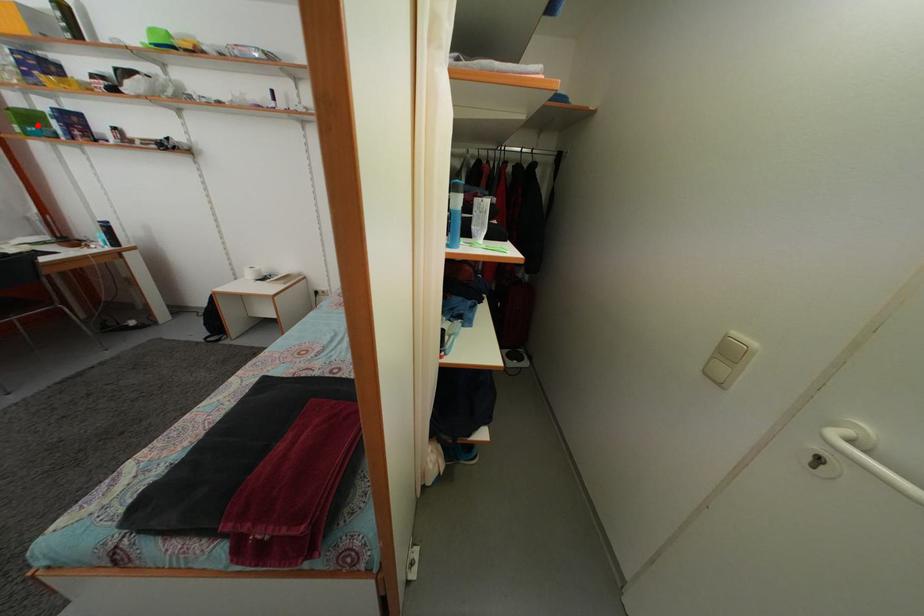
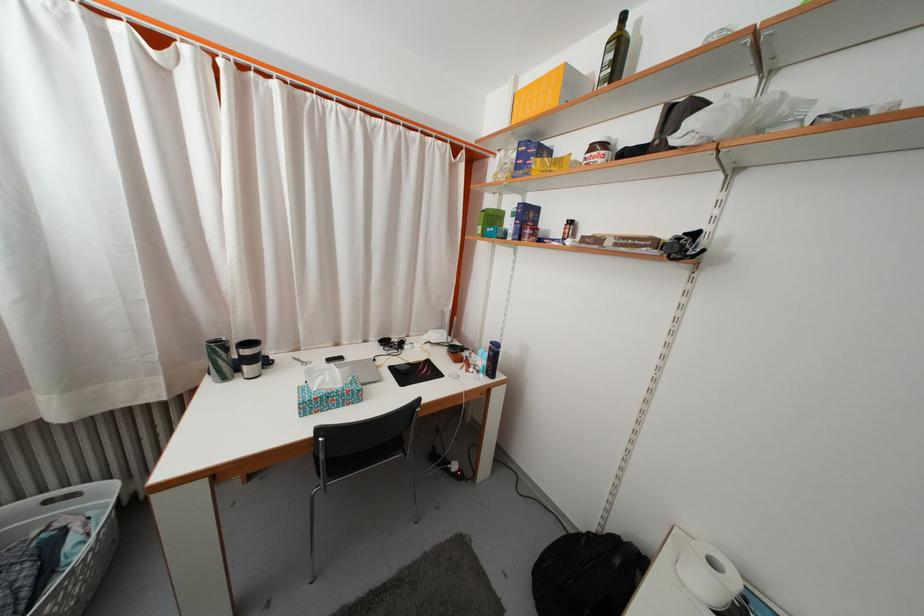
Where in the second image is the point corresponding to the highlighted location from the first image?

(500, 225)